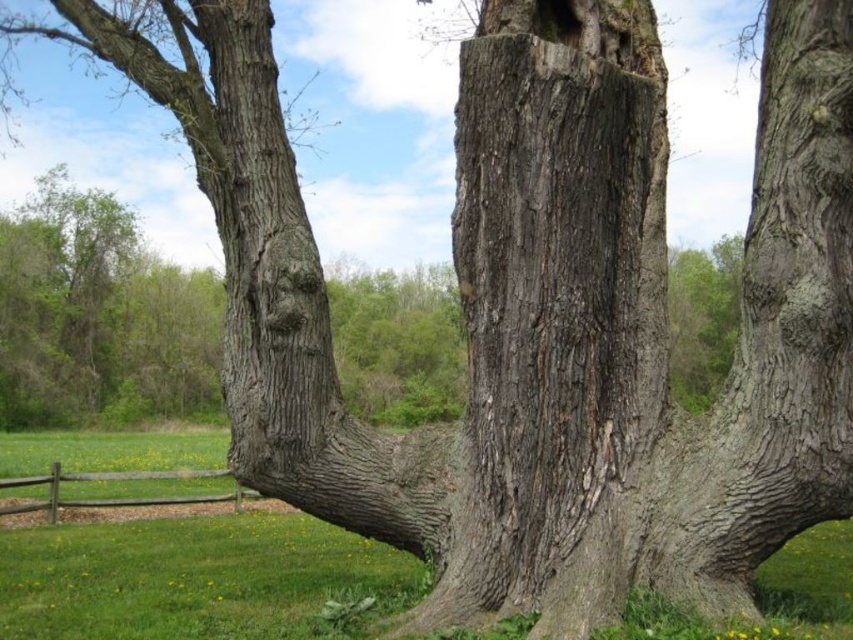
You are a painter standing at the edge of the grassy field with your easel. You want to paint both the gray rough bark tree trunk at center and the brown wooden fence at lower left. Which object should you move closer to in order to capture more detailed brushstrokes?

The gray rough bark tree trunk at center is larger in size than the brown wooden fence at lower left, so you should move closer to the brown wooden fence at lower left to capture more detailed brushstrokes.

You are standing in a field and see the gray rough bark tree trunk at center and the brown wooden fence at lower left. Which object appears taller in the image?

The gray rough bark tree trunk at center appears much taller than the brown wooden fence at lower left in the image.

You are standing in a field and want to take a photo of the gray rough bark tree trunk at center and the brown wooden fence at lower left. Which object will appear larger in your photo?

The gray rough bark tree trunk at center will appear larger in the photo because it is closer to the viewer than the brown wooden fence at lower left.